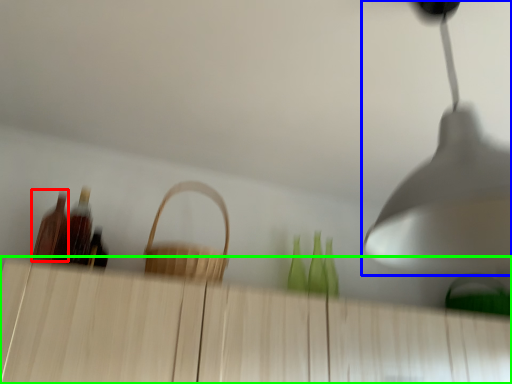
Question: Which object is the closest to the bottle (highlighted by a red box)? Choose among these: lamp (highlighted by a blue box) or dresser (highlighted by a green box).

Choices:
 (A) lamp
 (B) dresser

Answer: (B)